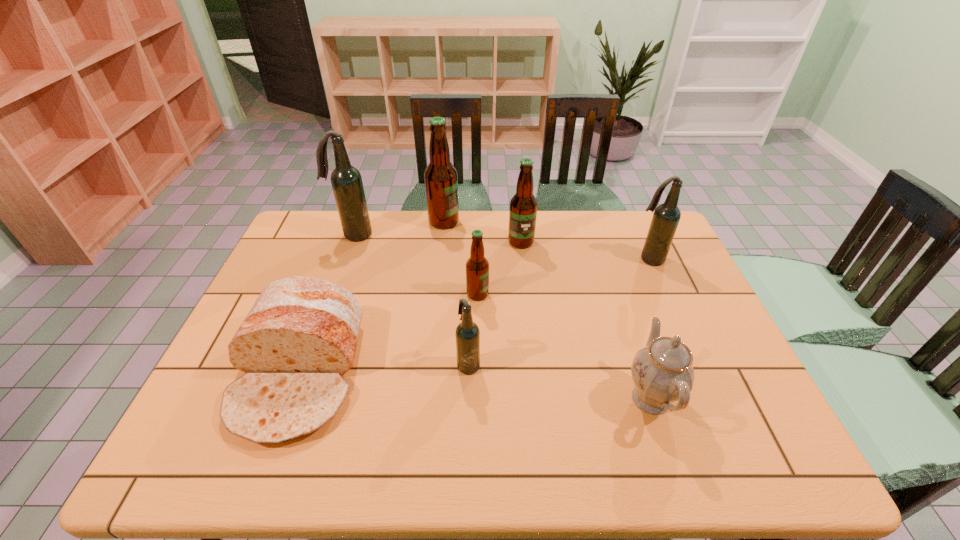
At what (x,y) coordinates should I click in order to perform the action: click on the sixth object from right to left. Please return your answer as a coordinate pair (x, y). The width and height of the screenshot is (960, 540). Looking at the image, I should click on (441, 181).

The width and height of the screenshot is (960, 540). I want to click on the farthest brown beer bottle, so pyautogui.click(x=441, y=181).

What are the coordinates of `the farthest dark beer bottle` in the screenshot? It's located at (346, 180).

Find the location of a particular element. the leftmost beer bottle is located at coordinates click(x=346, y=180).

Locate an element on the screen. the fourth farthest object is located at coordinates (666, 217).

Where is `the second nearest dark beer bottle`? This screenshot has width=960, height=540. the second nearest dark beer bottle is located at coordinates (666, 217).

Find the location of a particular element. The width and height of the screenshot is (960, 540). the second nearest brown beer bottle is located at coordinates (523, 206).

Where is `the third object from right to left`? the third object from right to left is located at coordinates (523, 206).

At what (x,y) coordinates should I click in order to perform the action: click on the fourth nearest object. Please return your answer as a coordinate pair (x, y). Looking at the image, I should click on (477, 266).

Where is `the smallest brown beer bottle`? This screenshot has width=960, height=540. the smallest brown beer bottle is located at coordinates (477, 266).